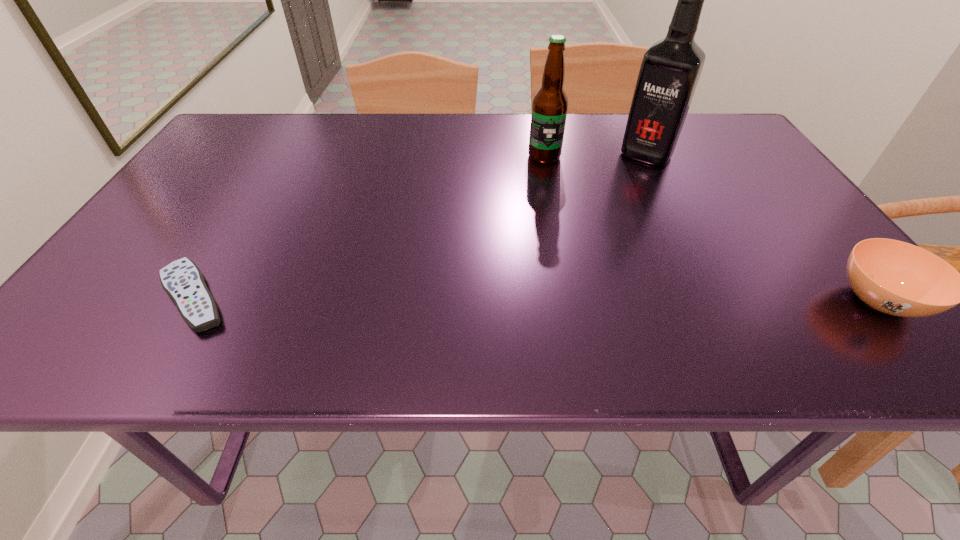
In order to click on the shortest object in this screenshot , I will do `click(182, 280)`.

Identify the location of the leftmost object. The image size is (960, 540). (182, 280).

Find the location of `soup bowl`. soup bowl is located at coordinates (897, 278).

I want to click on the second shortest object, so click(897, 278).

This screenshot has height=540, width=960. What are the coordinates of `liquor` in the screenshot? It's located at (670, 70).

Find the location of `the tallest object`. the tallest object is located at coordinates (670, 70).

Image resolution: width=960 pixels, height=540 pixels. I want to click on the third object from right to left, so click(550, 104).

Where is `the third shortest object`? Image resolution: width=960 pixels, height=540 pixels. the third shortest object is located at coordinates (550, 104).

Where is `free space located 0.390m on the right of the shortest object`? free space located 0.390m on the right of the shortest object is located at coordinates [x=445, y=296].

This screenshot has width=960, height=540. In order to click on vacant space located 0.350m on the left of the soup bowl in this screenshot , I will do `click(645, 300)`.